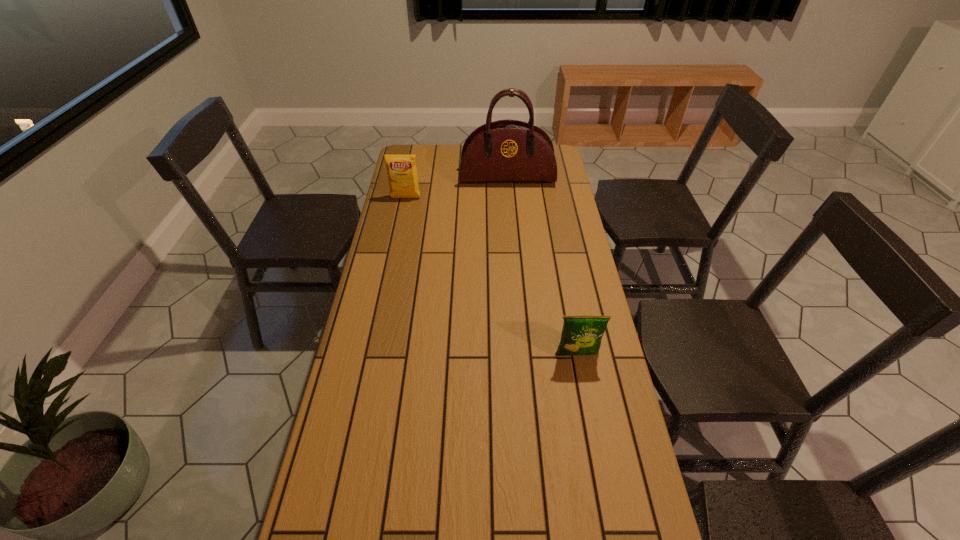
The height and width of the screenshot is (540, 960). Find the location of `the tallest object`. the tallest object is located at coordinates (508, 150).

Find the location of a particular element. This screenshot has width=960, height=540. handbag is located at coordinates (508, 150).

I want to click on the left crisp (potato chip), so click(x=401, y=169).

Where is `the second farthest object`? This screenshot has width=960, height=540. the second farthest object is located at coordinates point(401,169).

At what (x,y) coordinates should I click in order to perform the action: click on the nearer crisp (potato chip). Please return your answer as a coordinate pair (x, y). Looking at the image, I should click on (581, 335).

Image resolution: width=960 pixels, height=540 pixels. Identify the location of the right crisp (potato chip). (581, 335).

I want to click on free region located 0.360m on the front-facing side of the farthest object, so click(513, 242).

Locate an element on the screen. The image size is (960, 540). blank space located on the front of the leftmost object with the logo is located at coordinates (401, 221).

What are the coordinates of `vacant space located on the front-facing side of the right crisp (potato chip)` in the screenshot? It's located at (591, 435).

Identify the location of object at the far edge. This screenshot has width=960, height=540. (508, 150).